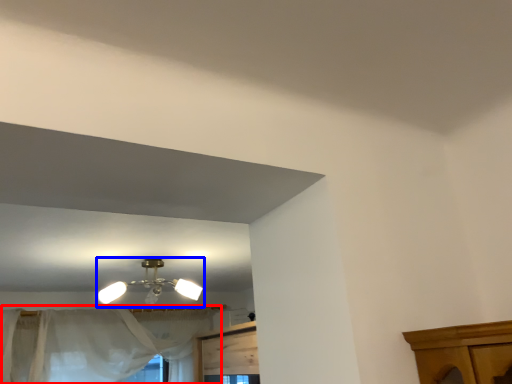
Question: Among these objects, which one is farthest to the camera, curtain (highlighted by a red box) or lamp (highlighted by a blue box)?

Choices:
 (A) curtain
 (B) lamp

Answer: (A)